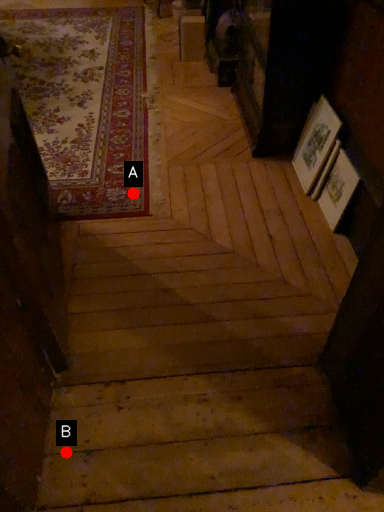
Question: Two points are circled on the image, labeled by A and B beside each circle. Which point appears farthest from the camera in this image?

Choices:
 (A) A is further
 (B) B is further

Answer: (A)